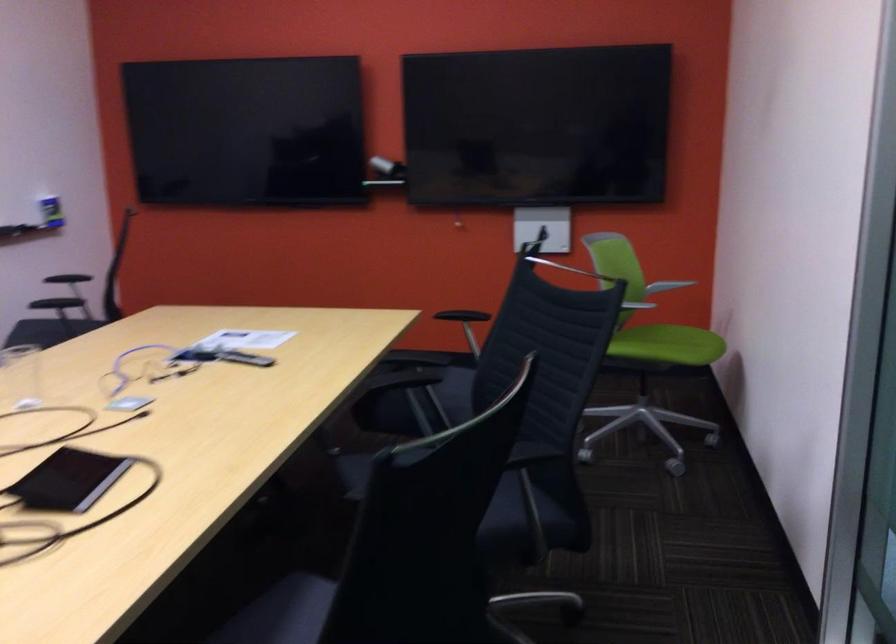
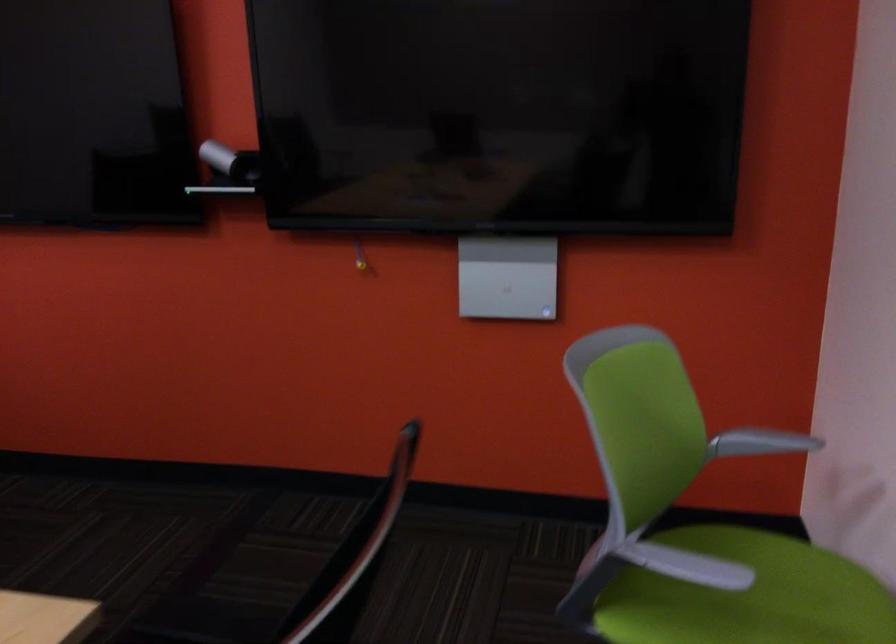
Question: In a continuous first-person perspective shot, in which direction is the camera moving?

Choices:
 (A) Left
 (B) Right
 (C) Forward
 (D) Backward

Answer: (C)